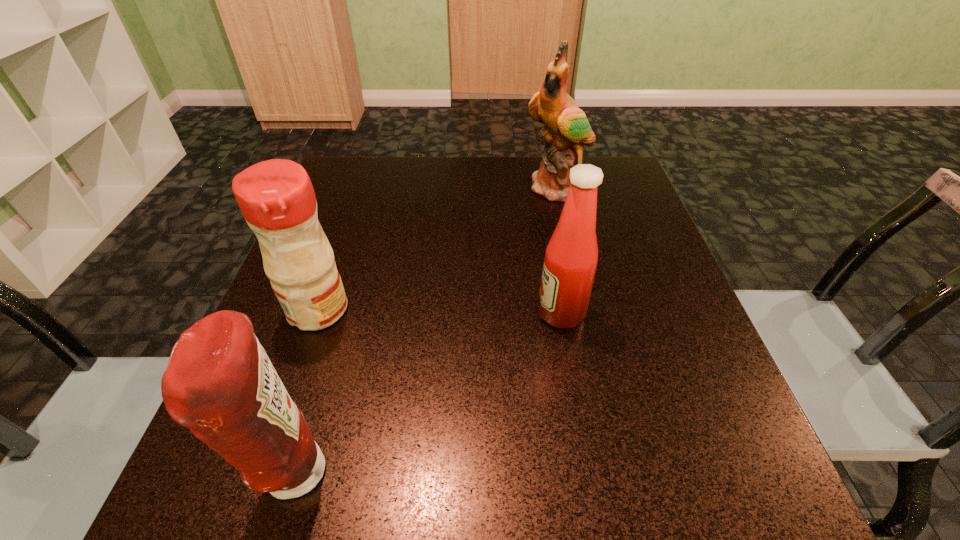
At what (x,y) coordinates should I click in order to perform the action: click on free space between the nearest object and the rightmost condiment. Please return your answer as a coordinate pair (x, y). The image size is (960, 540). Looking at the image, I should click on (428, 393).

Locate an element on the screen. The image size is (960, 540). free space between the rightmost condiment and the nearest object is located at coordinates (428, 393).

Identify the location of free space between the tallest object and the nearest object. Image resolution: width=960 pixels, height=540 pixels. (426, 331).

At what (x,y) coordinates should I click in order to perform the action: click on vacant area that lies between the nearest condiment and the rightmost condiment. Please return your answer as a coordinate pair (x, y). Looking at the image, I should click on (428, 393).

Locate an element on the screen. vacant area that lies between the rightmost condiment and the nearest object is located at coordinates (428, 393).

Locate which object is the closest to the rightmost condiment. Please provide its 2D coordinates. Your answer should be formatted as a tuple, i.e. [(x, y)], where the tuple contains the x and y coordinates of a point satisfying the conditions above.

[(567, 128)]

Identify the location of object that is the closest to the tallest object. (571, 257).

Locate which condiment is the second closest to the nearest object. Please provide its 2D coordinates. Your answer should be formatted as a tuple, i.e. [(x, y)], where the tuple contains the x and y coordinates of a point satisfying the conditions above.

[(571, 257)]

Identify which condiment is the second nearest to the nearest condiment. Please provide its 2D coordinates. Your answer should be formatted as a tuple, i.e. [(x, y)], where the tuple contains the x and y coordinates of a point satisfying the conditions above.

[(571, 257)]

What are the coordinates of `vacant region that satisfies the following two spatial constraints: 1. on the front-facing side of the tallest object; 2. on the front-facing side of the rightmost condiment` in the screenshot? It's located at (585, 313).